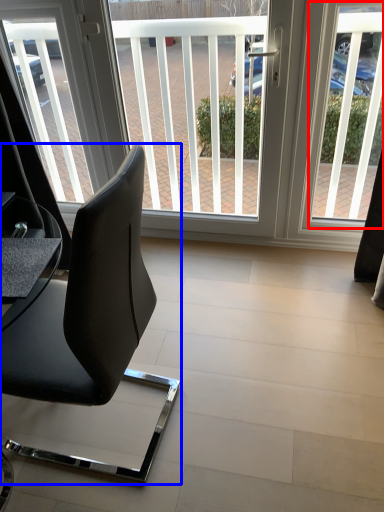
Question: Which object appears farthest to the camera in this image, window screen (highlighted by a red box) or chair (highlighted by a blue box)?

Choices:
 (A) window screen
 (B) chair

Answer: (A)